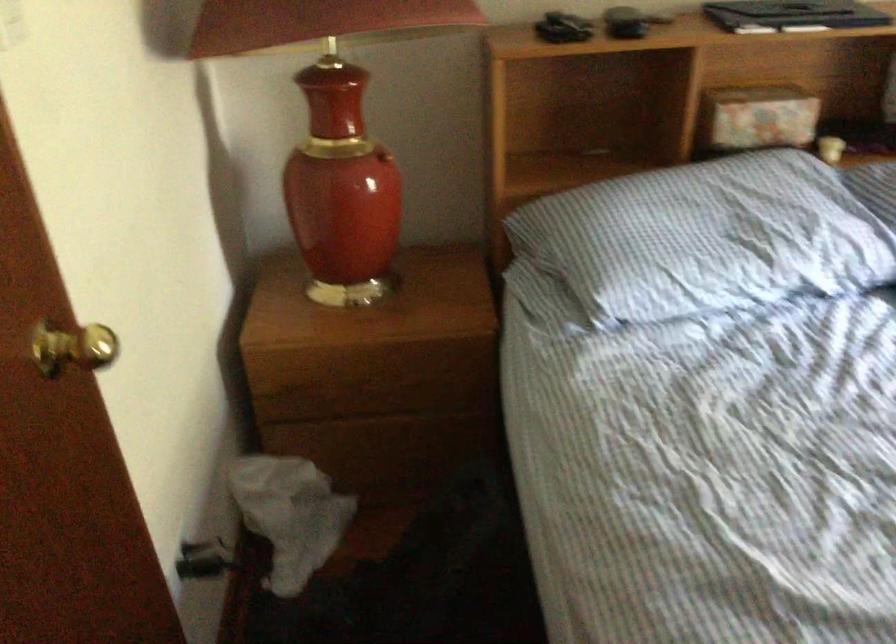
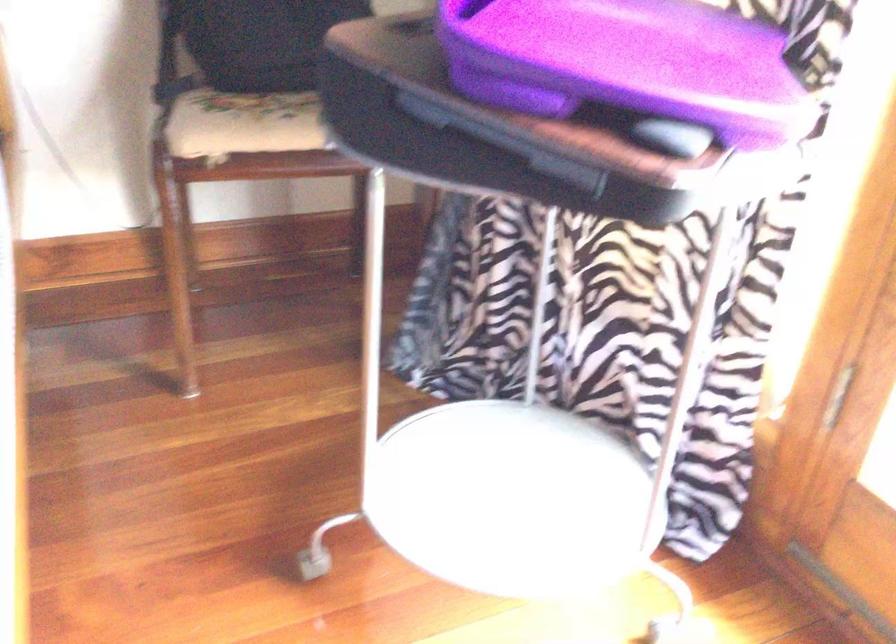
Question: What movement of the cameraman would produce the second image?

Choices:
 (A) Left
 (B) Right
 (C) Forward
 (D) Backward

Answer: (B)